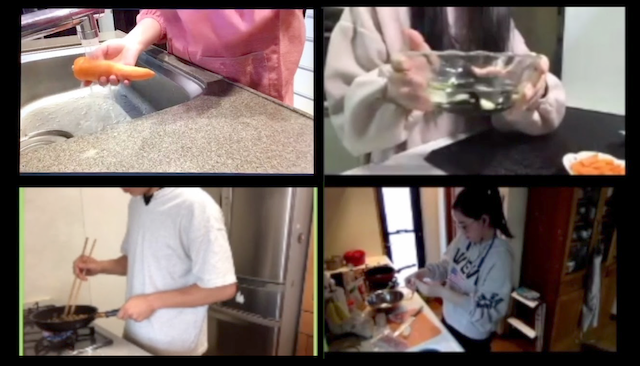
I want to click on kitchen, so click(x=299, y=93), click(x=275, y=230), click(x=523, y=305), click(x=580, y=99).